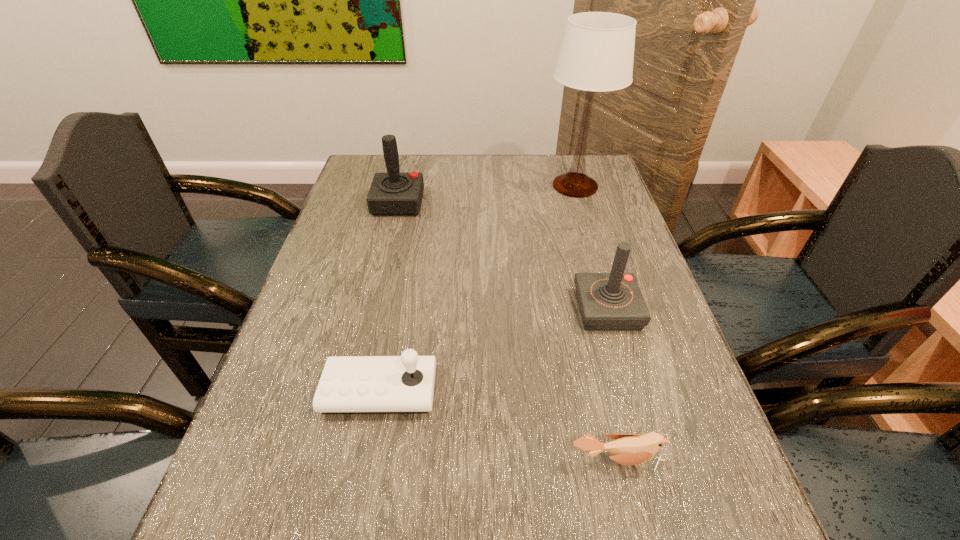
Find the location of a particular element. joystick positioned at the right edge is located at coordinates (613, 301).

Identify the location of bird located in the right edge section of the desktop. (627, 449).

Where is `object that is positioned at the far left corner`? The image size is (960, 540). object that is positioned at the far left corner is located at coordinates (393, 193).

Find the location of a particular element. This screenshot has width=960, height=540. object situated at the far right corner is located at coordinates pos(597,52).

At what (x,y) coordinates should I click in order to perform the action: click on free region at the far edge of the desktop. Please return your answer as a coordinate pair (x, y). The image size is (960, 540). Looking at the image, I should click on (446, 168).

This screenshot has width=960, height=540. In order to click on vacant space at the left edge of the desktop in this screenshot , I will do `click(271, 370)`.

Where is `blank area at the right edge`? Image resolution: width=960 pixels, height=540 pixels. blank area at the right edge is located at coordinates (600, 212).

In the image, there is a desktop. Identify the location of vacant space at the far right corner. (588, 160).

Where is `vacant space in between the farthest joystick and the second shortest object`? vacant space in between the farthest joystick and the second shortest object is located at coordinates (389, 297).

Identify the location of vacant area that lies between the fourth tallest object and the tallest object. pos(477,288).